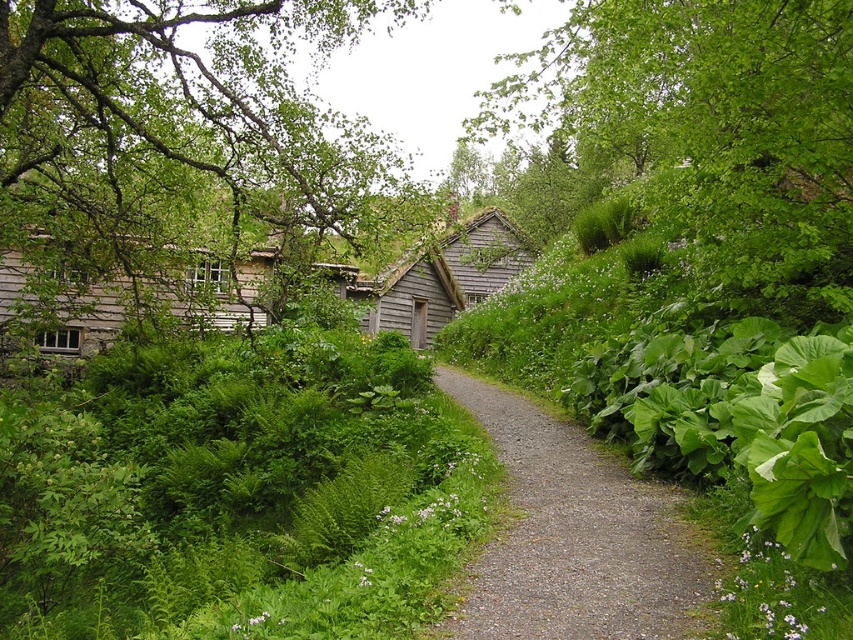
Is green leafy tree at left positioned in front of wooden shingles cabin at center?

That is True.

Does point (183, 161) come closer to viewer compared to point (366, 291)?

Yes, it is.

Who is more distant from viewer, (258, 172) or (485, 266)?

The point (485, 266) is behind.

This screenshot has height=640, width=853. What are the coordinates of `green leafy tree at left` in the screenshot? It's located at (186, 132).

Based on the photo, does green leafy tree at upper center appear over gray gravel path at center?

Yes, green leafy tree at upper center is above gray gravel path at center.

Does green leafy tree at upper center lie behind gray gravel path at center?

That is True.

Locate an element on the screen. green leafy tree at upper center is located at coordinates (712, 131).

Is green leafy tree at left positioned at the back of green leafy tree at upper center?

Yes, it is behind green leafy tree at upper center.

Is point (22, 211) less distant than point (811, 195)?

No, it is not.

You are a GUI agent. You are given a task and a screenshot of the screen. Output one action in this format:
    pyautogui.click(x=<x>, y=<y>)
    Task: Click on the green leafy tree at left
    
    Given the screenshot: What is the action you would take?
    pyautogui.click(x=186, y=132)